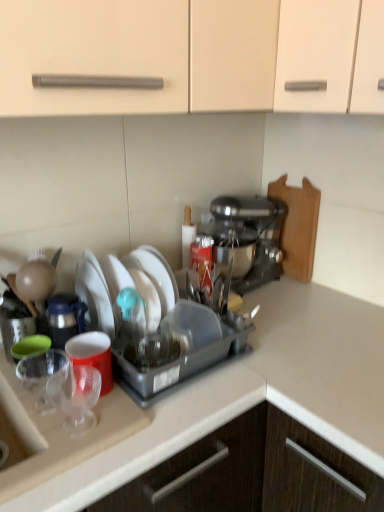
Identify the location of vacant area that is in front of matte plastic cup at left. (74, 438).